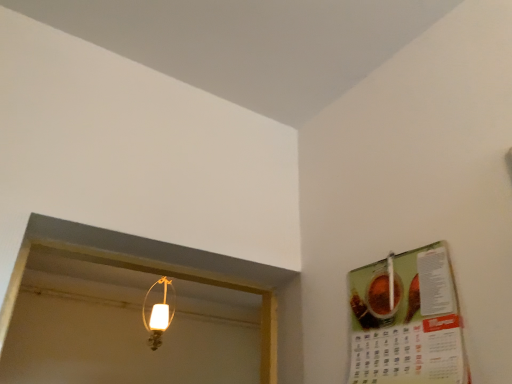
Question: Considering the positions of point (158, 332) and point (377, 268), is point (158, 332) closer or farther from the camera than point (377, 268)?

Choices:
 (A) farther
 (B) closer

Answer: (A)

Question: From the image's perspective, is matte glass lampshade at upper center above or below green matte calendar at upper right?

Choices:
 (A) below
 (B) above

Answer: (A)

Question: Is matte glass lampshade at upper center in front of or behind green matte calendar at upper right in the image?

Choices:
 (A) front
 (B) behind

Answer: (B)

Question: Is point (366, 329) closer or farther from the camera than point (142, 301)?

Choices:
 (A) closer
 (B) farther

Answer: (A)

Question: Relative to matte glass lampshade at upper center, is green matte calendar at upper right in front or behind?

Choices:
 (A) behind
 (B) front

Answer: (B)

Question: Considering the positions of green matte calendar at upper right and matte glass lampshade at upper center in the image, is green matte calendar at upper right taller or shorter than matte glass lampshade at upper center?

Choices:
 (A) tall
 (B) short

Answer: (B)

Question: From a real-world perspective, is green matte calendar at upper right physically located above or below matte glass lampshade at upper center?

Choices:
 (A) above
 (B) below

Answer: (B)